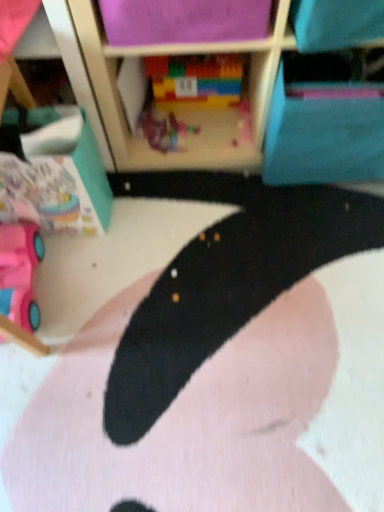
At what (x,y) coordinates should I click in order to perform the action: click on vacant area that lies between multicolored plastic blocks at center, which is the 3th toy from bottom to top, and plastic toy at center, which is counted as the second toy, starting from the left. Please return your answer as a coordinate pair (x, y). This screenshot has width=384, height=512. Looking at the image, I should click on (208, 122).